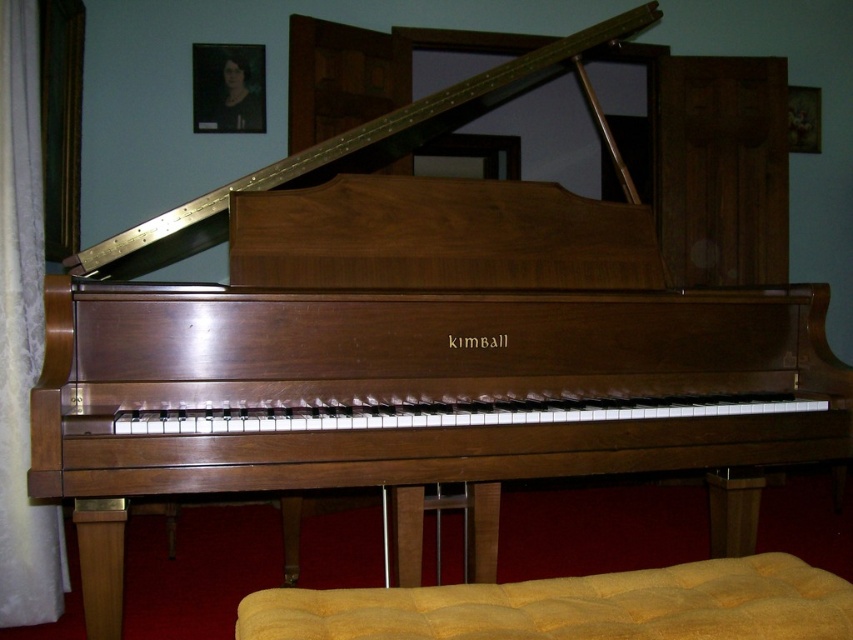
You are a stagehand setting up for a performance. You need to move the velvet curtain at left to the back of the stage. However, there is a yellow fabric footrest at lower center in the way. Can you move the footrest out of the way to access the curtain?

The yellow fabric footrest at lower center is in front of the velvet curtain at left, so you can move the footrest to access the curtain.

You are a musician preparing for a recital and need to adjust your seating position. You see the yellow fabric footrest at lower center and the velvet curtain at left. Which object is positioned lower in the scene?

The yellow fabric footrest at lower center is located below the velvet curtain at left, so it is positioned lower in the scene.

You are a person with a height of 5 feet 6 inches. You are standing in front of the Kimball grand piano and want to sit on the yellow fabric footrest at lower center. Considering your height, will your feet touch the ground when sitting on it?

The yellow fabric footrest at lower center is 3.89 feet from viewer. Since your height is 5 feet 6 inches, your legs are approximately 3.5 feet long, which is shorter than the distance to the footrest. Therefore, your feet will not touch the ground when sitting on the yellow fabric footrest at lower center.